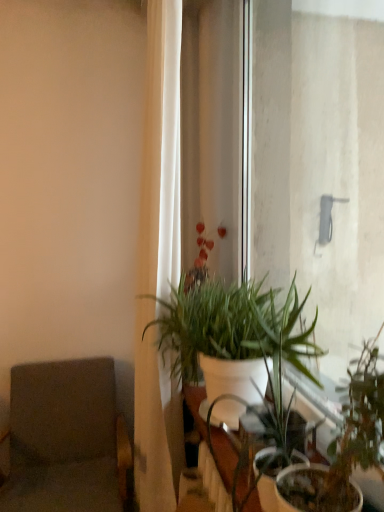
Locate an element on the screen. The height and width of the screenshot is (512, 384). white glossy table at center is located at coordinates (224, 456).

Image resolution: width=384 pixels, height=512 pixels. What do you see at coordinates (345, 447) in the screenshot?
I see `green matte plant at center, arranged as the second houseplant when viewed from the back` at bounding box center [345, 447].

Image resolution: width=384 pixels, height=512 pixels. I want to click on green matte plant at center, arranged as the second houseplant when viewed from the back, so click(345, 447).

What do you see at coordinates (230, 326) in the screenshot?
I see `white matte plant at center, the first houseplant when ordered from back to front` at bounding box center [230, 326].

Identify the location of white glossy table at center. (224, 456).

Is point (342, 431) behind point (306, 346)?

No, (342, 431) is in front of (306, 346).

Is green matte plant at center, arranged as the second houseplant when viewed from the back, positioned behind white matte plant at center, the first houseplant when ordered from back to front?

That is False.

From a real-world perspective, does green matte plant at center, arranged as the second houseplant when viewed from the back, stand above white matte plant at center, the first houseplant when ordered from back to front?

No, from a real-world perspective, green matte plant at center, arranged as the second houseplant when viewed from the back, is not over white matte plant at center, the first houseplant when ordered from back to front

Is green matte plant at center, arranged as the second houseplant when viewed from the back, wider or thinner than white fabric curtain at left?

Clearly, green matte plant at center, arranged as the second houseplant when viewed from the back, has more width compared to white fabric curtain at left.

Locate an element on the screen. The height and width of the screenshot is (512, 384). the 2nd houseplant below the white fabric curtain at left (from the image's perspective) is located at coordinates (345, 447).

Is point (337, 464) positioned behind point (156, 218)?

That is False.

Which of these two, white glossy table at center or gray fabric swivel chair at left, is wider?

Wider between the two is gray fabric swivel chair at left.

Could you tell me if white glossy table at center is facing gray fabric swivel chair at left?

No, white glossy table at center is not facing towards gray fabric swivel chair at left.

Is gray fabric swivel chair at left completely or partially inside white glossy table at center?

No, gray fabric swivel chair at left is not a part of white glossy table at center.

Locate an element on the screen. The height and width of the screenshot is (512, 384). table lying on the right of gray fabric swivel chair at left is located at coordinates (224, 456).

Which object is further away from the camera, green matte plant at center, acting as the first houseplant starting from the front, or white glossy table at center?

white glossy table at center is behind.

I want to click on table on the left of the green matte plant at center, acting as the first houseplant starting from the front, so [224, 456].

From the image's perspective, is green matte plant at center, acting as the first houseplant starting from the front, above white glossy table at center?

No, from the image's perspective, green matte plant at center, acting as the first houseplant starting from the front, is not over white glossy table at center.

Is gray fabric swivel chair at left at the left side of green matte plant at center, acting as the first houseplant starting from the front?

Yes, gray fabric swivel chair at left is to the left of green matte plant at center, acting as the first houseplant starting from the front.

Based on the photo, how far apart are gray fabric swivel chair at left and green matte plant at center, arranged as the second houseplant when viewed from the back?

4.08 feet.

From their relative heights in the image, would you say gray fabric swivel chair at left is taller or shorter than green matte plant at center, arranged as the second houseplant when viewed from the back?

Clearly, gray fabric swivel chair at left is taller compared to green matte plant at center, arranged as the second houseplant when viewed from the back.

Would you say white matte plant at center, the first houseplant when ordered from back to front, is part of gray fabric swivel chair at left's contents?

No, white matte plant at center, the first houseplant when ordered from back to front, is located outside of gray fabric swivel chair at left.

From the image's perspective, between gray fabric swivel chair at left and white matte plant at center, which is the second houseplant in front-to-back order, who is located below?

From the image's view, gray fabric swivel chair at left is below.

Is gray fabric swivel chair at left far away from white matte plant at center, which is the second houseplant in front-to-back order?

gray fabric swivel chair at left is actually quite close to white matte plant at center, which is the second houseplant in front-to-back order.

The height and width of the screenshot is (512, 384). Identify the location of the 1st houseplant counting from the right side of the gray fabric swivel chair at left. (230, 326).

In order to click on table that appears above the green matte plant at center, acting as the first houseplant starting from the front (from a real-world perspective) in this screenshot , I will do `click(224, 456)`.

Considering the relative sizes of white glossy table at center and green matte plant at center, acting as the first houseplant starting from the front, in the image provided, is white glossy table at center shorter than green matte plant at center, acting as the first houseplant starting from the front,?

No, white glossy table at center is not shorter than green matte plant at center, acting as the first houseplant starting from the front.

In the scene shown: Which of these two, white glossy table at center or green matte plant at center, arranged as the second houseplant when viewed from the back, is smaller?

white glossy table at center is smaller.

Which is less distant, (222, 452) or (338, 496)?

Clearly, point (222, 452) is more distant from the camera than point (338, 496).

Where is `houseplant to the right of white matte plant at center, the first houseplant when ordered from back to front`? The height and width of the screenshot is (512, 384). houseplant to the right of white matte plant at center, the first houseplant when ordered from back to front is located at coordinates (345, 447).

From a real-world perspective, count 2nd houseplants downward from the white fabric curtain at left and point to it. Please provide its 2D coordinates.

[(345, 447)]

Based on their spatial positions, is white fabric curtain at left or gray fabric swivel chair at left further from white matte plant at center, which is the second houseplant in front-to-back order?

gray fabric swivel chair at left.

From the picture: Considering their positions, is gray fabric swivel chair at left positioned closer to white matte plant at center, which is the second houseplant in front-to-back order, than green matte plant at center, acting as the first houseplant starting from the front?

green matte plant at center, acting as the first houseplant starting from the front, lies closer to white matte plant at center, which is the second houseplant in front-to-back order, than the other object.

Considering their positions, is white fabric curtain at left positioned closer to green matte plant at center, acting as the first houseplant starting from the front, than gray fabric swivel chair at left?

white fabric curtain at left is closer to green matte plant at center, acting as the first houseplant starting from the front.

Looking at the image, which one is located closer to white glossy table at center, white matte plant at center, which is the second houseplant in front-to-back order, or white fabric curtain at left?

white matte plant at center, which is the second houseplant in front-to-back order, lies closer to white glossy table at center than the other object.

Considering their positions, is white glossy table at center positioned closer to white matte plant at center, the first houseplant when ordered from back to front, than green matte plant at center, arranged as the second houseplant when viewed from the back?

white glossy table at center.

Which object lies nearer to the anchor point white glossy table at center, white fabric curtain at left or gray fabric swivel chair at left?

white fabric curtain at left is closer to white glossy table at center.

From the image, which object appears to be nearer to white fabric curtain at left, white matte plant at center, the first houseplant when ordered from back to front, or gray fabric swivel chair at left?

white matte plant at center, the first houseplant when ordered from back to front.

Considering their positions, is white matte plant at center, the first houseplant when ordered from back to front, positioned further to white glossy table at center than gray fabric swivel chair at left?

gray fabric swivel chair at left lies further to white glossy table at center than the other object.

In order to click on curtain between green matte plant at center, arranged as the second houseplant when viewed from the back, and gray fabric swivel chair at left from front to back in this screenshot , I will do `click(161, 153)`.

Find the location of `houseplant between gray fabric swivel chair at left and white glossy table at center`. houseplant between gray fabric swivel chair at left and white glossy table at center is located at coordinates (230, 326).

Identify the location of table located between green matte plant at center, acting as the first houseplant starting from the front, and white fabric curtain at left in the depth direction. (224, 456).

This screenshot has width=384, height=512. What are the coordinates of `houseplant between green matte plant at center, arranged as the second houseplant when viewed from the back, and white fabric curtain at left, along the z-axis` in the screenshot? It's located at (230, 326).